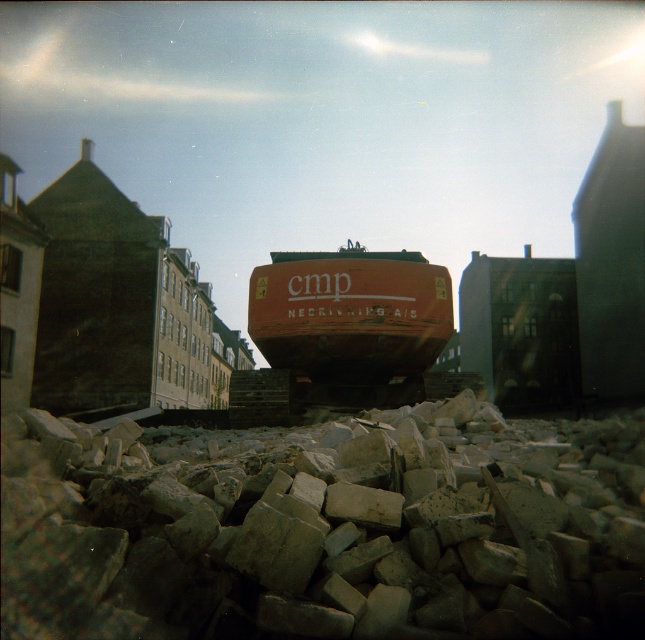
Question: Considering the relative positions of gray rough gravel at lower center and rusty metal excavator at center in the image provided, where is gray rough gravel at lower center located with respect to rusty metal excavator at center?

Choices:
 (A) left
 (B) right

Answer: (B)

Question: Which point is farther to the camera?

Choices:
 (A) (359, 387)
 (B) (26, 481)

Answer: (A)

Question: Is gray rough gravel at lower center above rusty metal excavator at center?

Choices:
 (A) yes
 (B) no

Answer: (B)

Question: Does gray rough gravel at lower center appear under rusty metal excavator at center?

Choices:
 (A) yes
 (B) no

Answer: (A)

Question: Which point is closer to the camera taking this photo?

Choices:
 (A) (461, 566)
 (B) (319, 384)

Answer: (A)